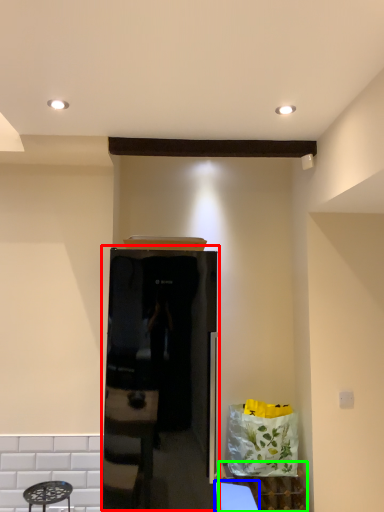
Question: Which is farther away from appliance (highlighted by a red box)? table (highlighted by a blue box) or cabinetry (highlighted by a green box)?

Choices:
 (A) table
 (B) cabinetry

Answer: (B)